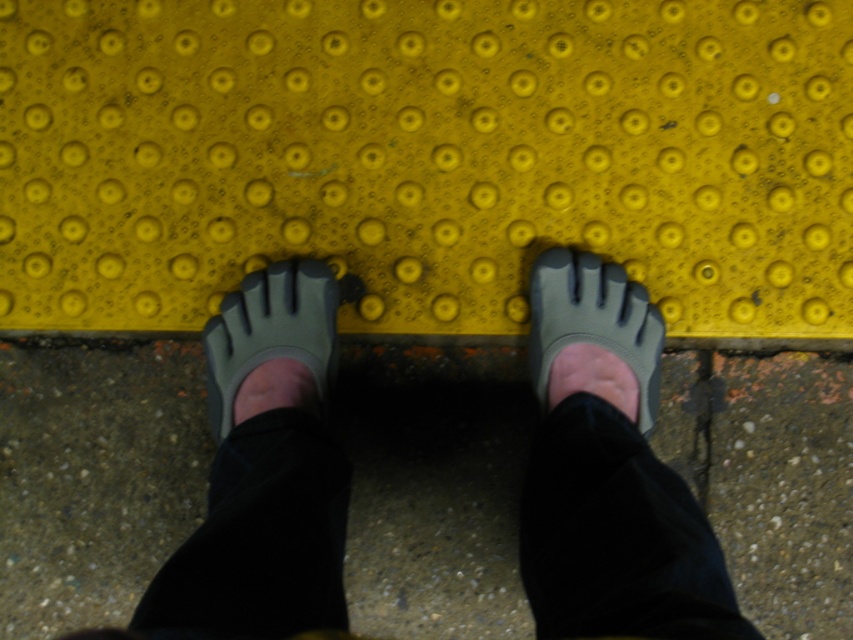
Question: Which object is the closest to the concrete at center?

Choices:
 (A) yellow rubber curb at center
 (B) matte gray toe separator at center

Answer: (B)

Question: Is concrete at center positioned in front of matte gray toe separator at center?

Choices:
 (A) yes
 (B) no

Answer: (B)

Question: Which of these objects is positioned farthest from the yellow rubber curb at center?

Choices:
 (A) gray rubber toe separator at center
 (B) matte gray toe separator at center
 (C) concrete at center

Answer: (C)

Question: Is concrete at center further to camera compared to matte gray toe separator at center?

Choices:
 (A) yes
 (B) no

Answer: (A)

Question: Is gray rubber toe separator at center bigger than matte gray toe separator at center?

Choices:
 (A) yes
 (B) no

Answer: (A)

Question: Which of the following is the closest to the observer?

Choices:
 (A) (822, 600)
 (B) (276, 294)
 (C) (537, 348)

Answer: (B)